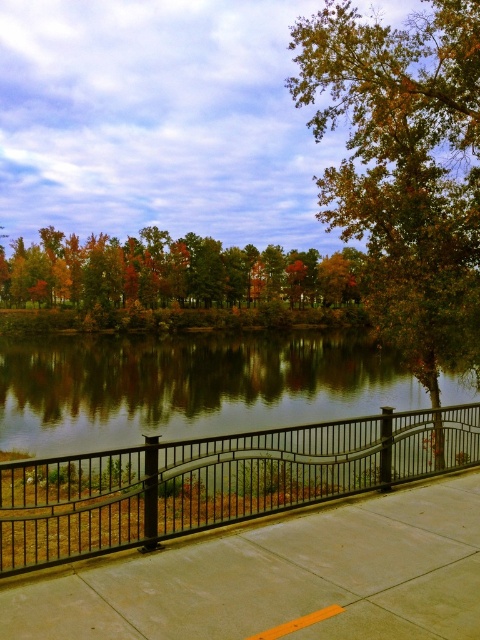
Which is more to the left, glossy black water at center or autumn leaves at center?

glossy black water at center

Is point (308, 380) more distant than point (165, 288)?

No, it is not.

Who is more distant from viewer, (72, 355) or (153, 227)?

Point (153, 227)

The image size is (480, 640). I want to click on glossy black water at center, so click(x=188, y=387).

Does golden leaves tree at center appear on the left side of glossy black water at center?

Incorrect, golden leaves tree at center is not on the left side of glossy black water at center.

Is golden leaves tree at center further to camera compared to glossy black water at center?

Yes, it is.

Is point (411, 220) positioned after point (252, 387)?

No, it is in front of (252, 387).

Find the location of a particular element. golden leaves tree at center is located at coordinates (405, 168).

Is point (372, 625) closer to camera compared to point (146, 227)?

Yes, it is.

Between concrete at center and autumn leaves at center, which one appears on the right side from the viewer's perspective?

concrete at center

Who is more distant from viewer, (232, 552) or (310, 301)?

The point (310, 301) is behind.

Identify the location of concrete at center. This screenshot has width=480, height=640. (278, 577).